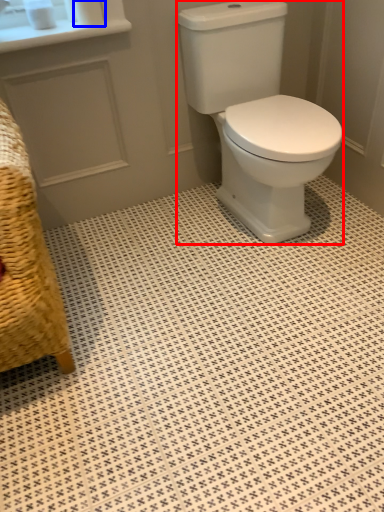
Question: Which point is closer to the camera, porcelain (highlighted by a red box) or toilet paper (highlighted by a blue box)?

Choices:
 (A) porcelain
 (B) toilet paper

Answer: (A)